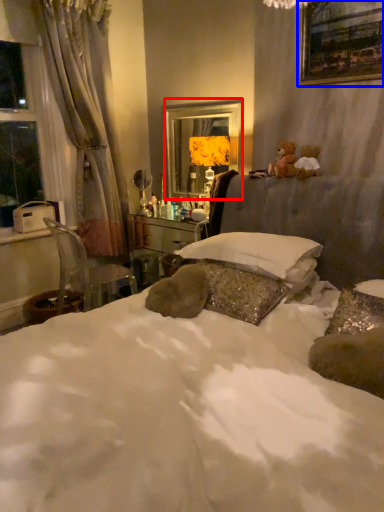
Question: Among these objects, which one is farthest to the camera, mirror (highlighted by a red box) or picture frame (highlighted by a blue box)?

Choices:
 (A) mirror
 (B) picture frame

Answer: (A)